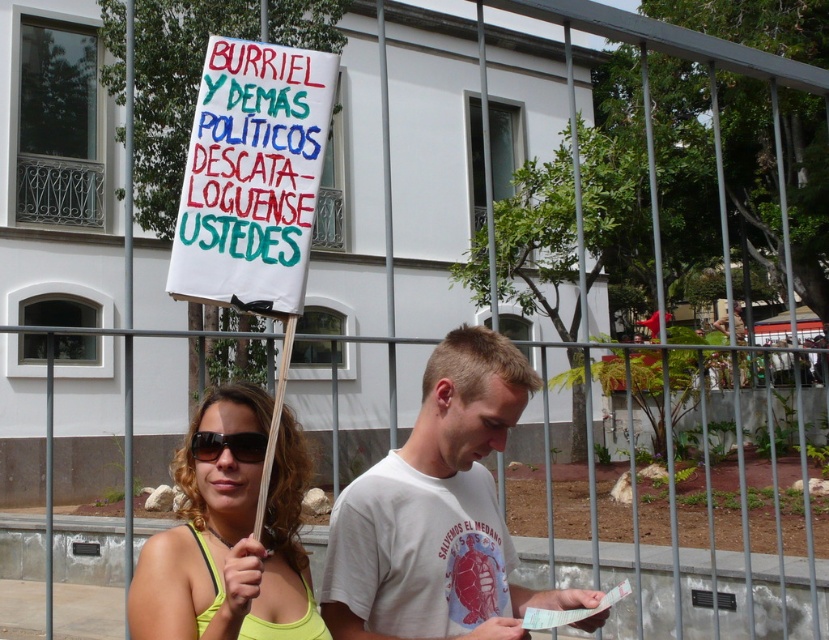
Between white cotton t-shirt at center and black plastic goggles at center, which one appears on the left side from the viewer's perspective?

black plastic goggles at center is more to the left.

This screenshot has height=640, width=829. Describe the element at coordinates (439, 513) in the screenshot. I see `white cotton t-shirt at center` at that location.

Does point (429, 488) come behind point (192, 436)?

Yes, point (429, 488) is farther from viewer.

You are a GUI agent. You are given a task and a screenshot of the screen. Output one action in this format:
    pyautogui.click(x=<x>, y=<y>)
    Task: Click on the white cotton t-shirt at center
    
    Given the screenshot: What is the action you would take?
    pyautogui.click(x=439, y=513)

Does white paper sign at center appear under yellow-green fabric at center?

No.

Is point (274, 172) farther from camera compared to point (236, 467)?

Yes, point (274, 172) is behind point (236, 467).

Find the location of a particular element. white paper sign at center is located at coordinates (251, 177).

Which is in front, point (250, 253) or point (211, 449)?

Point (211, 449)

Describe the element at coordinates (251, 177) in the screenshot. I see `white paper sign at center` at that location.

Locate an element on the screen. The height and width of the screenshot is (640, 829). white paper sign at center is located at coordinates (251, 177).